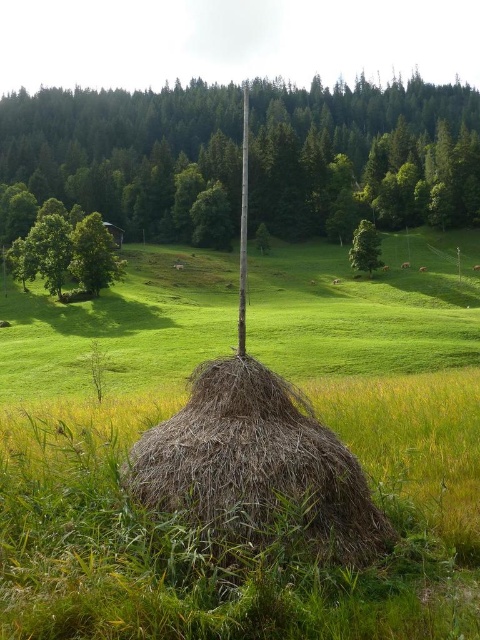
Between point (365, 179) and point (96, 280), which one is positioned in front?

Point (96, 280) is in front.

Measure the distance between brown rough pole at center and camera.

The distance of brown rough pole at center from camera is 411.53 feet.

You are a GUI agent. You are given a task and a screenshot of the screen. Output one action in this format:
    pyautogui.click(x=<x>, y=<y>)
    Task: Click on the brown rough pole at center
    This screenshot has width=480, height=640.
    Given the screenshot: What is the action you would take?
    pyautogui.click(x=362, y=156)

Who is positioned more to the left, brown rough pole at center or smooth wood pole at center?

smooth wood pole at center is more to the left.

Which is below, brown rough pole at center or smooth wood pole at center?

Positioned lower is smooth wood pole at center.

In the scene shown: Who is more forward, (153, 221) or (245, 122)?

Point (153, 221) is more forward.

The height and width of the screenshot is (640, 480). Identify the location of brown rough pole at center. (362, 156).

Can you confirm if brown rough pole at center is thinner than green leafy tree at center?

Incorrect, brown rough pole at center's width is not less than green leafy tree at center's.

Is brown rough pole at center positioned before green leafy tree at center?

No, it is not.

Where is `brown rough pole at center`? Image resolution: width=480 pixels, height=640 pixels. brown rough pole at center is located at coordinates (362, 156).

The width and height of the screenshot is (480, 640). I want to click on brown rough pole at center, so click(x=362, y=156).